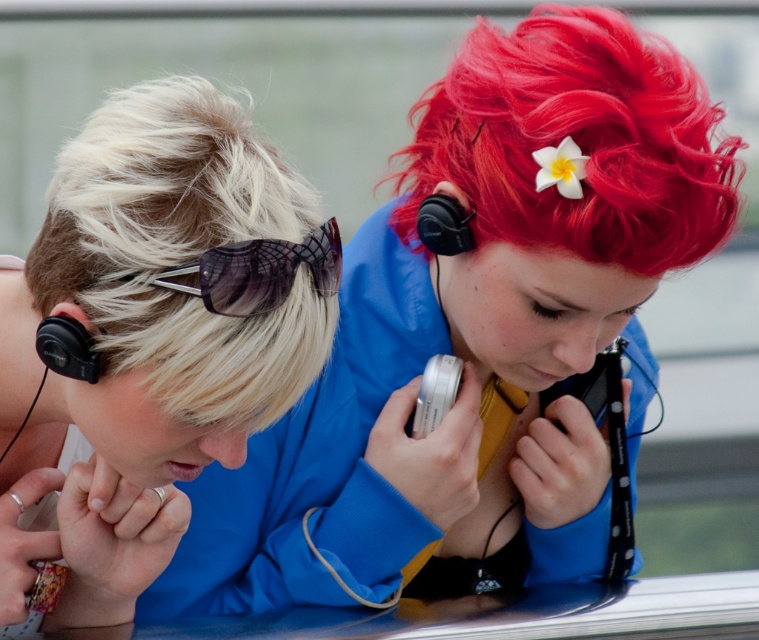
Is point (594, 176) farther from viewer compared to point (455, 195)?

No, it is in front of (455, 195).

This screenshot has width=759, height=640. Describe the element at coordinates (578, 141) in the screenshot. I see `vivid red hair at upper right` at that location.

The height and width of the screenshot is (640, 759). What are the coordinates of `vivid red hair at upper right` in the screenshot? It's located at (578, 141).

Is vivid red hair at upper right above black matte earphone at upper right?

Yes, vivid red hair at upper right is above black matte earphone at upper right.

Who is positioned more to the left, vivid red hair at upper right or black matte earphone at upper right?

black matte earphone at upper right

At what (x,y) coordinates should I click in order to perform the action: click on vivid red hair at upper right. Please return your answer as a coordinate pair (x, y). This screenshot has width=759, height=640. Looking at the image, I should click on (578, 141).

Is vivid red hair at upper right to the left of transparent plastic goggles at upper left from the viewer's perspective?

No, vivid red hair at upper right is not to the left of transparent plastic goggles at upper left.

Measure the distance between vivid red hair at upper right and camera.

The distance of vivid red hair at upper right from camera is 2.08 meters.

Describe the element at coordinates (578, 141) in the screenshot. The image size is (759, 640). I see `vivid red hair at upper right` at that location.

Locate an element on the screen. The width and height of the screenshot is (759, 640). vivid red hair at upper right is located at coordinates (578, 141).